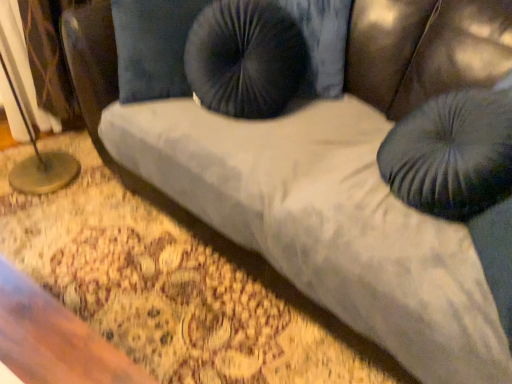
Question: Is velvet dark blue bean bag at upper center taller than metallic gold table lamp at left?

Choices:
 (A) no
 (B) yes

Answer: (A)

Question: Is metallic gold table lamp at left completely or partially inside velvet dark blue bean bag at upper center?

Choices:
 (A) yes
 (B) no

Answer: (B)

Question: Would you say velvet dark blue bean bag at upper center is a long distance from metallic gold table lamp at left?

Choices:
 (A) yes
 (B) no

Answer: (A)

Question: From the image's perspective, is velvet dark blue bean bag at upper center located beneath metallic gold table lamp at left?

Choices:
 (A) yes
 (B) no

Answer: (A)

Question: Can you confirm if velvet dark blue bean bag at upper center is thinner than metallic gold table lamp at left?

Choices:
 (A) no
 (B) yes

Answer: (B)

Question: In terms of width, does suede-like black pillow at center look wider or thinner when compared to metallic gold table lamp at left?

Choices:
 (A) wide
 (B) thin

Answer: (B)

Question: In terms of height, does suede-like black pillow at center look taller or shorter compared to metallic gold table lamp at left?

Choices:
 (A) short
 (B) tall

Answer: (A)

Question: Considering the positions of suede-like black pillow at center and metallic gold table lamp at left in the image, is suede-like black pillow at center bigger or smaller than metallic gold table lamp at left?

Choices:
 (A) big
 (B) small

Answer: (B)

Question: Which is correct: suede-like black pillow at center is inside metallic gold table lamp at left, or outside of it?

Choices:
 (A) inside
 (B) outside

Answer: (B)

Question: Based on their sizes in the image, would you say velvet dark blue bean bag at upper center is bigger or smaller than metallic gold table lamp at left?

Choices:
 (A) small
 (B) big

Answer: (A)

Question: Relative to metallic gold table lamp at left, is velvet dark blue bean bag at upper center in front or behind?

Choices:
 (A) behind
 (B) front

Answer: (B)

Question: From a real-world perspective, is velvet dark blue bean bag at upper center physically located above or below metallic gold table lamp at left?

Choices:
 (A) above
 (B) below

Answer: (A)

Question: In terms of height, does velvet dark blue bean bag at upper center look taller or shorter compared to metallic gold table lamp at left?

Choices:
 (A) tall
 (B) short

Answer: (B)

Question: From the image's perspective, is velvet dark blue bean bag at upper center above or below suede-like black pillow at center?

Choices:
 (A) below
 (B) above

Answer: (A)

Question: Is point (454, 92) closer or farther from the camera than point (176, 87)?

Choices:
 (A) closer
 (B) farther

Answer: (A)